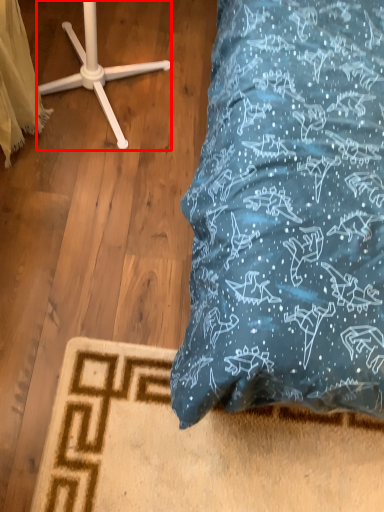
Question: Considering the relative positions of furniture (annotated by the red box) and material in the image provided, where is furniture (annotated by the red box) located with respect to the staircase?

Choices:
 (A) right
 (B) left

Answer: (A)